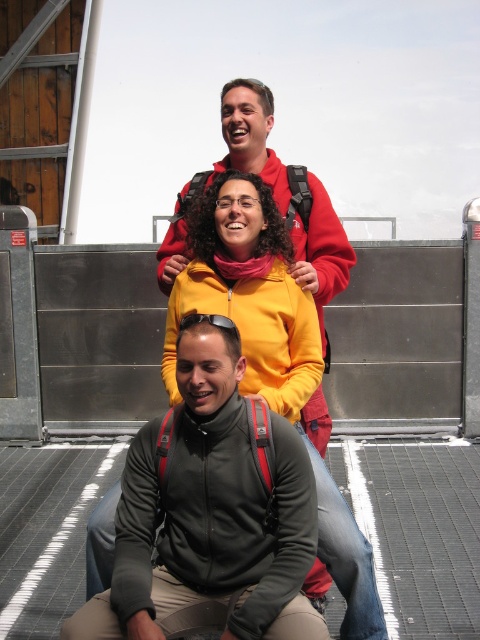
Question: Is the position of yellow matte jacket at center less distant than that of matte red jacket at upper center?

Choices:
 (A) yes
 (B) no

Answer: (A)

Question: Which point is closer to the camera taking this photo?

Choices:
 (A) (321, 212)
 (B) (359, 602)

Answer: (B)

Question: Observing the image, what is the correct spatial positioning of yellow matte jacket at center in reference to matte red jacket at upper center?

Choices:
 (A) below
 (B) above

Answer: (A)

Question: Which of the following is the closest to the observer?

Choices:
 (A) (244, 195)
 (B) (315, 291)

Answer: (A)

Question: Does yellow matte jacket at center have a greater width compared to matte red jacket at upper center?

Choices:
 (A) no
 (B) yes

Answer: (A)